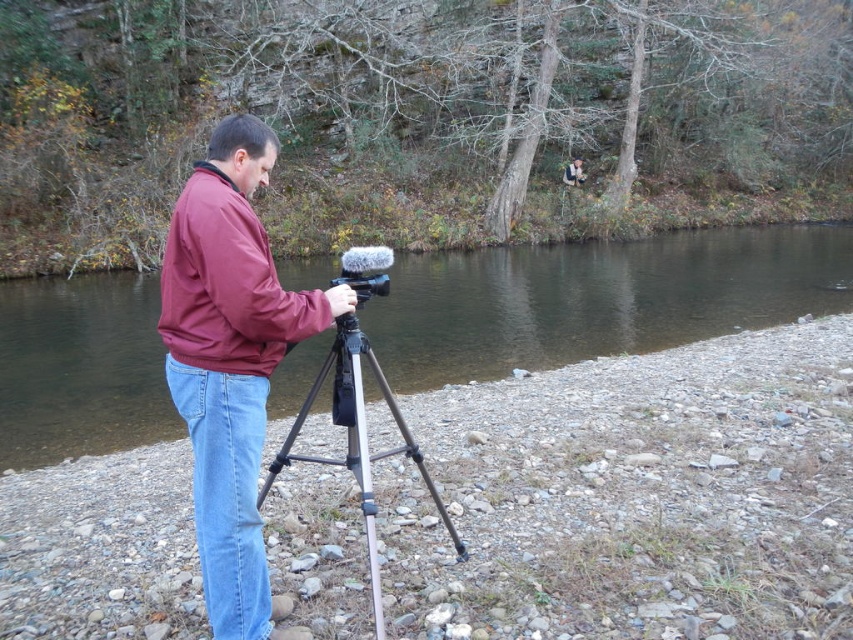
Between point (405, 312) and point (225, 573), which one is positioned behind?

Positioned behind is point (405, 312).

Where is `clear water at center`? The image size is (853, 640). clear water at center is located at coordinates (598, 298).

Can you confirm if clear water at center is positioned to the right of matte red jacket at center?

Correct, you'll find clear water at center to the right of matte red jacket at center.

Is point (51, 390) positioned before point (281, 289)?

No, (51, 390) is further to viewer.

Between point (322, 264) and point (236, 189), which one is positioned in front?

Point (236, 189)

Identify the location of clear water at center. pos(598,298).

Is light blue denim jeans at lower left to the right of silver metallic tripod at center from the viewer's perspective?

In fact, light blue denim jeans at lower left is to the left of silver metallic tripod at center.

Between light blue denim jeans at lower left and silver metallic tripod at center, which one is positioned lower?

silver metallic tripod at center is lower down.

Locate an element on the screen. The height and width of the screenshot is (640, 853). light blue denim jeans at lower left is located at coordinates tap(225, 492).